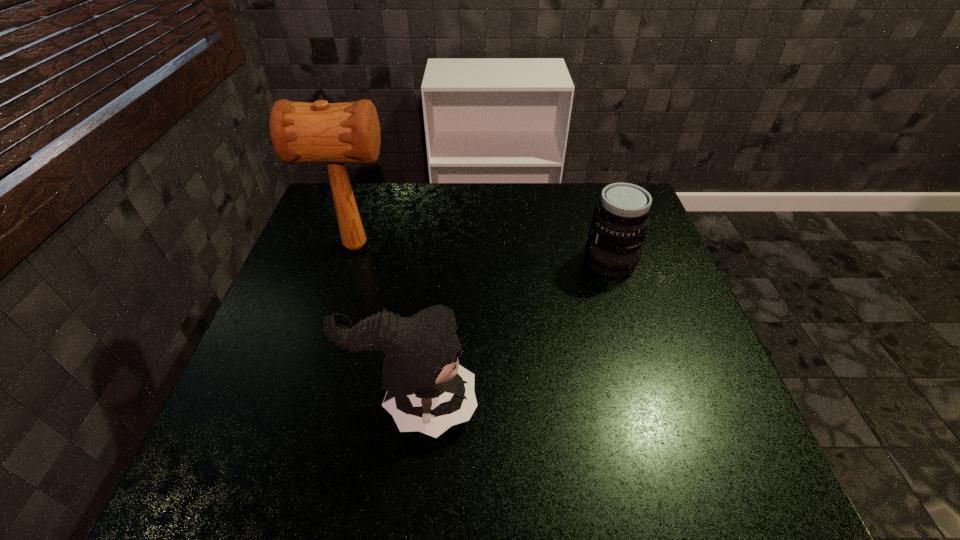
What are the coordinates of `mallet` in the screenshot? It's located at (336, 133).

This screenshot has width=960, height=540. Identify the location of doll. (428, 391).

In order to click on the second tallest object in this screenshot , I will do `click(428, 391)`.

Where is `the shortest object`? Image resolution: width=960 pixels, height=540 pixels. the shortest object is located at coordinates (620, 221).

I want to click on the rightmost object, so 620,221.

The image size is (960, 540). Identify the location of vacant area located on the strike surface of the mallet. (468, 246).

The height and width of the screenshot is (540, 960). Find the location of `vacant region located 0.400m at the face of the nearest object`. vacant region located 0.400m at the face of the nearest object is located at coordinates (673, 404).

This screenshot has width=960, height=540. I want to click on vacant point located on the left of the telephoto lens, so click(448, 262).

You are a GUI agent. You are given a task and a screenshot of the screen. Output one action in this format:
    pyautogui.click(x=<x>, y=<y>)
    Task: Click on the object that is at the left edge
    Image resolution: width=960 pixels, height=540 pixels.
    Given the screenshot: What is the action you would take?
    pyautogui.click(x=336, y=133)

The width and height of the screenshot is (960, 540). In order to click on object that is at the right edge in this screenshot , I will do `click(620, 221)`.